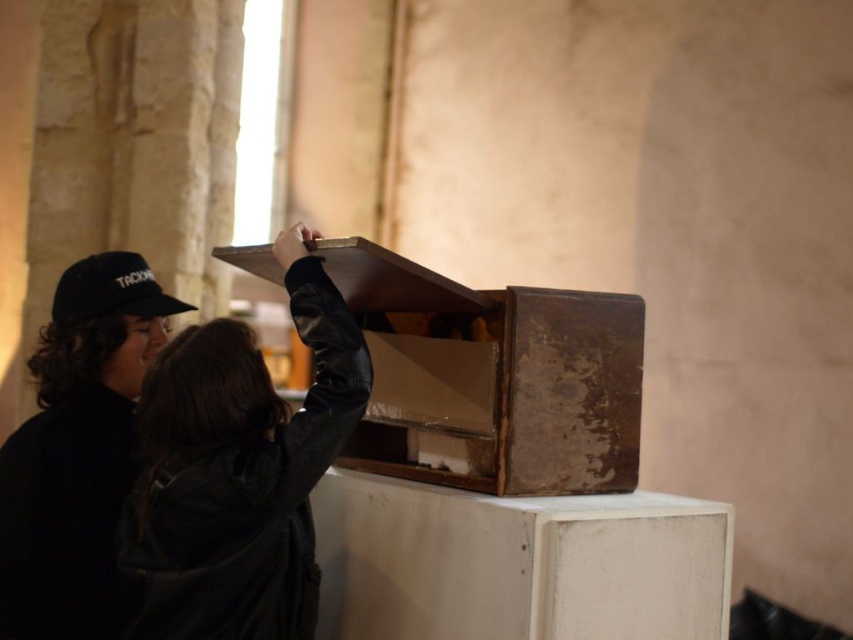
Question: Among these objects, which one is nearest to the camera?

Choices:
 (A) rusty wood box at center
 (B) matte black jacket at center
 (C) black leather jacket at left

Answer: (B)

Question: Estimate the real-world distances between objects in this image. Which object is farther from the matte black jacket at center?

Choices:
 (A) black leather jacket at left
 (B) black fabric baseball cap at upper left
 (C) rusty wood box at center

Answer: (B)

Question: Based on their relative distances, which object is nearer to the black fabric baseball cap at upper left?

Choices:
 (A) matte black jacket at center
 (B) black leather jacket at left
 (C) rusty wood box at center

Answer: (B)

Question: From the image, what is the correct spatial relationship of matte black jacket at center in relation to rusty wood box at center?

Choices:
 (A) above
 (B) below

Answer: (B)

Question: Is matte black jacket at center smaller than black leather jacket at left?

Choices:
 (A) yes
 (B) no

Answer: (A)

Question: Is rusty wood box at center closer to the viewer compared to black leather jacket at left?

Choices:
 (A) no
 (B) yes

Answer: (B)